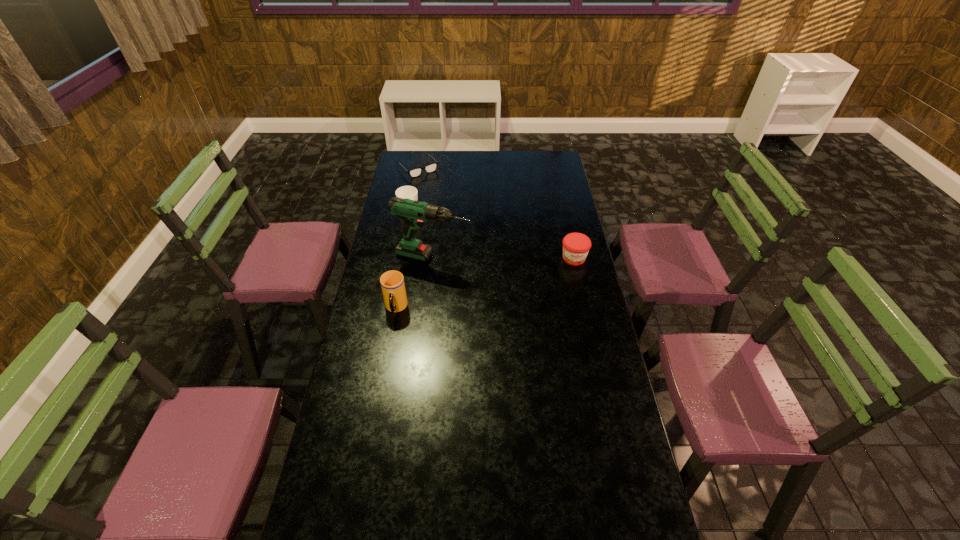
In order to click on free space between the farther cup and the jam in this screenshot , I will do `click(492, 235)`.

Where is `free space between the nearer cup and the jam`? free space between the nearer cup and the jam is located at coordinates (485, 284).

The image size is (960, 540). I want to click on free point between the jam and the spectacles, so click(496, 213).

Locate an element on the screen. vacant area that lies between the drill and the second tallest object is located at coordinates (415, 282).

This screenshot has height=540, width=960. I want to click on vacant space that's between the tallest object and the rightmost object, so 504,258.

Where is `empty space that is in between the rightmost object and the shorter cup`? The width and height of the screenshot is (960, 540). empty space that is in between the rightmost object and the shorter cup is located at coordinates coord(492,235).

The height and width of the screenshot is (540, 960). I want to click on object that stands as the fourth closest to the tallest object, so click(x=415, y=172).

This screenshot has width=960, height=540. What are the coordinates of `object that is the fourth nearest to the spectacles` in the screenshot? It's located at (392, 283).